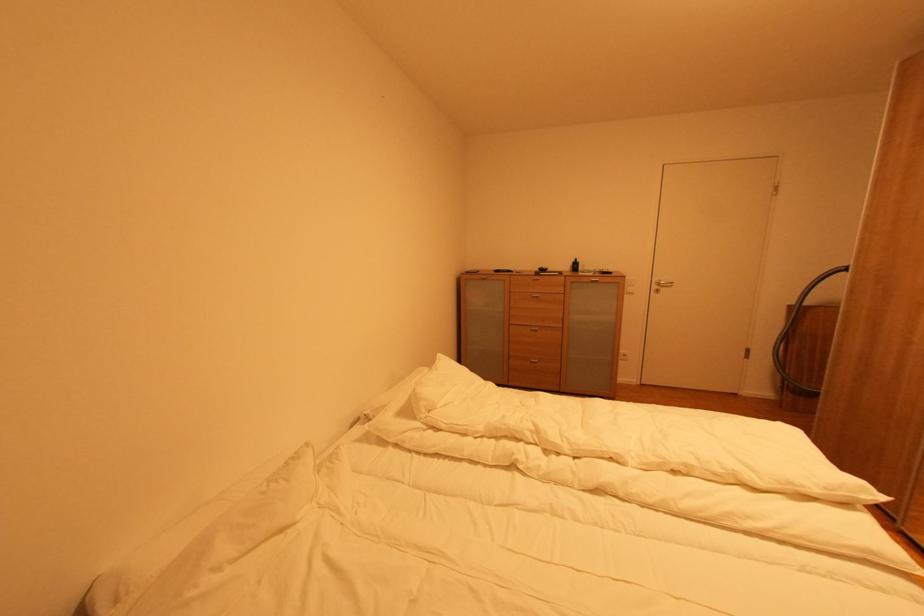
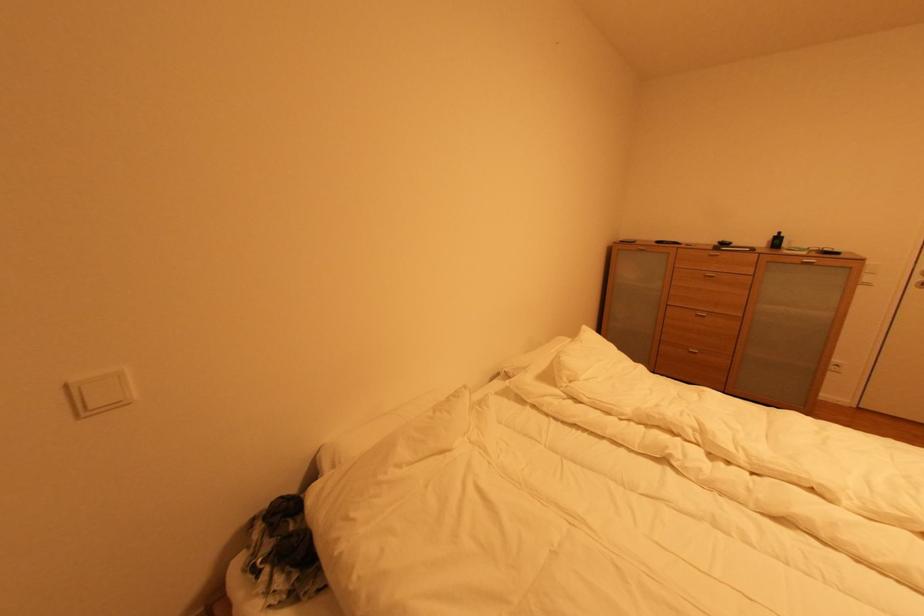
Question: How did the camera likely rotate?

Choices:
 (A) Left
 (B) Right
 (C) Up
 (D) Down

Answer: (A)